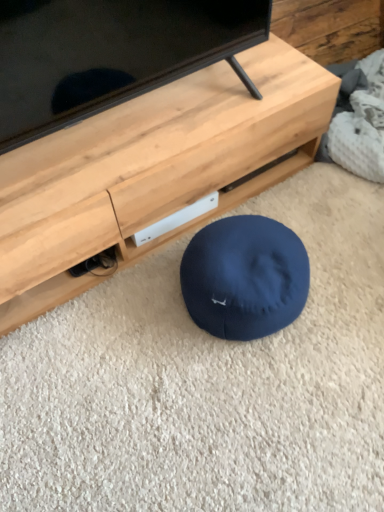
Identify the location of free space underneath matte black tv at center (from a real-world perspective). This screenshot has width=384, height=512. (138, 118).